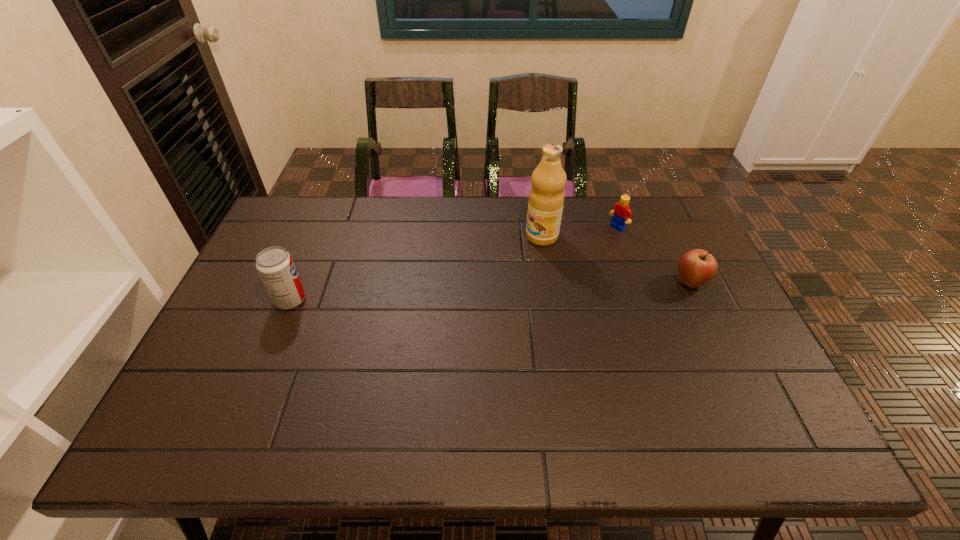
Find the location of a particular element. The height and width of the screenshot is (540, 960). vacant space at the right edge of the desktop is located at coordinates (658, 257).

The width and height of the screenshot is (960, 540). In the image, there is a desktop. What are the coordinates of `vacant space at the near left corner` in the screenshot? It's located at coord(225,395).

Locate an element on the screen. This screenshot has height=540, width=960. unoccupied area between the rightmost object and the olive oil is located at coordinates (616, 260).

Locate an element on the screen. vacant area that lies between the soda and the olive oil is located at coordinates (416, 268).

Image resolution: width=960 pixels, height=540 pixels. In order to click on vacant area that lies between the soda and the rightmost object in this screenshot , I will do `click(491, 291)`.

Locate an element on the screen. This screenshot has width=960, height=540. free space between the third object from left to right and the rightmost object is located at coordinates (654, 255).

Identify the location of free point between the leftmost object and the olive oil. 416,268.

This screenshot has height=540, width=960. I want to click on free spot between the apple and the third object from left to right, so click(654, 255).

In order to click on vacant region between the second object from right to left and the rightmost object in this screenshot , I will do `click(654, 255)`.

This screenshot has height=540, width=960. Find the location of `free area in between the apple and the second tallest object`. free area in between the apple and the second tallest object is located at coordinates point(491,291).